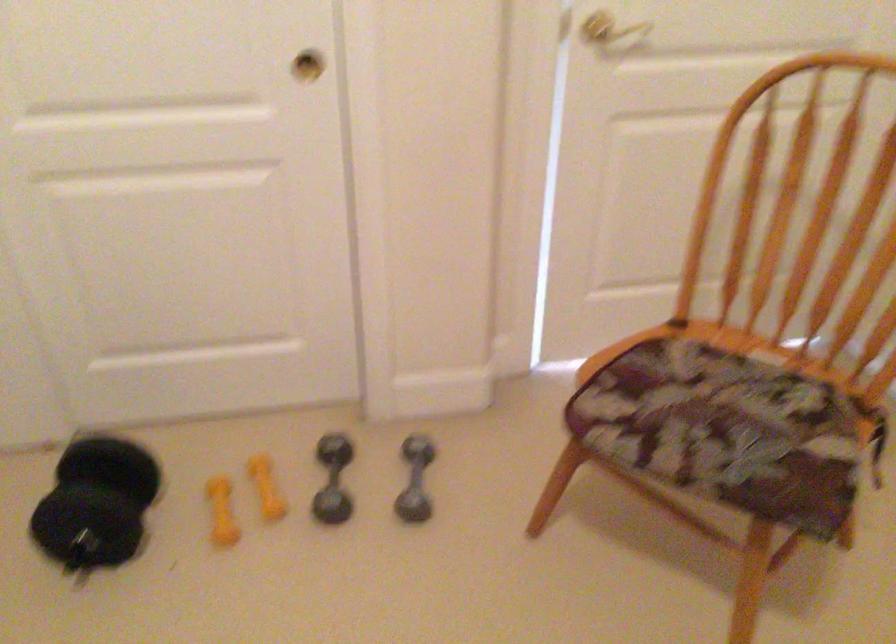
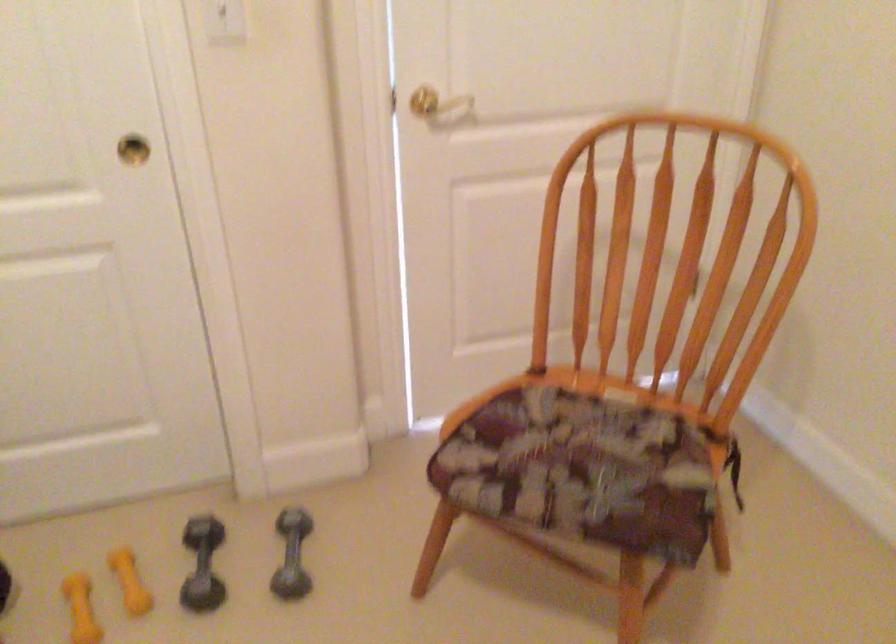
Question: How did the camera likely rotate?

Choices:
 (A) Left
 (B) Right
 (C) Up
 (D) Down

Answer: (B)